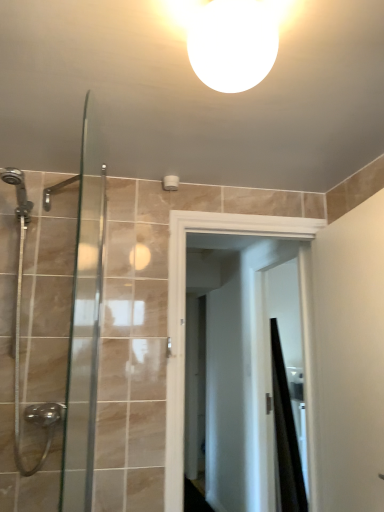
Question: Is white glossy light fixture at upper center to the left of matte white screen door at center from the viewer's perspective?

Choices:
 (A) no
 (B) yes

Answer: (B)

Question: Considering the relative sizes of white glossy light fixture at upper center and matte white screen door at center in the image provided, is white glossy light fixture at upper center bigger than matte white screen door at center?

Choices:
 (A) no
 (B) yes

Answer: (A)

Question: Does white glossy light fixture at upper center contain matte white screen door at center?

Choices:
 (A) yes
 (B) no

Answer: (B)

Question: Could you tell me if white glossy light fixture at upper center is facing matte white screen door at center?

Choices:
 (A) no
 (B) yes

Answer: (A)

Question: Can you see white glossy light fixture at upper center touching matte white screen door at center?

Choices:
 (A) yes
 (B) no

Answer: (B)

Question: Is white glossy sink at upper center taller or shorter than matte white screen door at center?

Choices:
 (A) tall
 (B) short

Answer: (B)

Question: From a real-world perspective, is white glossy sink at upper center physically located above or below matte white screen door at center?

Choices:
 (A) below
 (B) above

Answer: (A)

Question: Based on their sizes in the image, would you say white glossy sink at upper center is bigger or smaller than matte white screen door at center?

Choices:
 (A) small
 (B) big

Answer: (A)

Question: In the image, is white glossy sink at upper center positioned in front of or behind matte white screen door at center?

Choices:
 (A) front
 (B) behind

Answer: (B)

Question: In terms of height, does clear glass shower door at left look taller or shorter compared to black matte shower curtain at right?

Choices:
 (A) short
 (B) tall

Answer: (A)

Question: From a real-world perspective, is clear glass shower door at left positioned above or below black matte shower curtain at right?

Choices:
 (A) above
 (B) below

Answer: (A)

Question: In the image, is clear glass shower door at left on the left side or the right side of black matte shower curtain at right?

Choices:
 (A) left
 (B) right

Answer: (A)

Question: Looking at the image, does clear glass shower door at left seem bigger or smaller compared to black matte shower curtain at right?

Choices:
 (A) big
 (B) small

Answer: (B)

Question: Looking at their shapes, would you say white glossy light fixture at upper center is wider or thinner than black matte shower curtain at right?

Choices:
 (A) wide
 (B) thin

Answer: (B)

Question: From the image's perspective, is white glossy light fixture at upper center positioned above or below black matte shower curtain at right?

Choices:
 (A) below
 (B) above

Answer: (B)